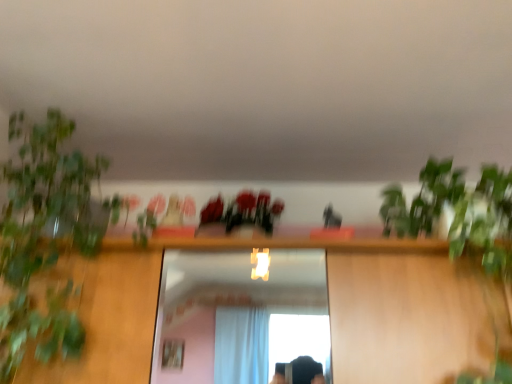
Question: From a real-world perspective, is matte plastic flowers at center positioned above or below green leafy plant at left?

Choices:
 (A) above
 (B) below

Answer: (A)

Question: Looking at the image, does matte plastic flowers at center seem bigger or smaller compared to green leafy plant at left?

Choices:
 (A) big
 (B) small

Answer: (B)

Question: Considering the positions of point (225, 223) and point (37, 321), is point (225, 223) closer or farther from the camera than point (37, 321)?

Choices:
 (A) farther
 (B) closer

Answer: (A)

Question: Visually, is green leafy plant at left positioned to the left or to the right of matte plastic flowers at center?

Choices:
 (A) left
 (B) right

Answer: (A)

Question: Relative to matte plastic flowers at center, is green leafy plant at left in front or behind?

Choices:
 (A) behind
 (B) front

Answer: (B)

Question: Is point (53, 304) positioned closer to the camera than point (222, 213)?

Choices:
 (A) closer
 (B) farther

Answer: (A)

Question: Considering the positions of green leafy plant at left and matte plastic flowers at center in the image, is green leafy plant at left wider or thinner than matte plastic flowers at center?

Choices:
 (A) wide
 (B) thin

Answer: (A)